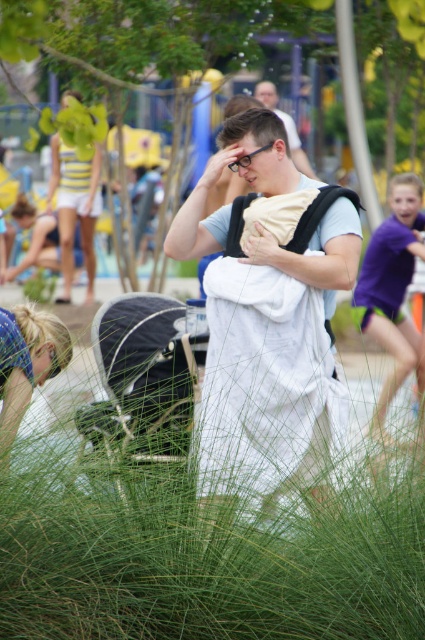
Question: Can you confirm if purple cotton shirt at right is wider than blonde hair at lower left?

Choices:
 (A) no
 (B) yes

Answer: (B)

Question: Which point appears closest to the camera in this image?

Choices:
 (A) (65, 161)
 (B) (374, 426)

Answer: (B)

Question: Does green soft grass at center lie behind blonde hair at lower left?

Choices:
 (A) yes
 (B) no

Answer: (B)

Question: Can you confirm if green soft grass at center is positioned to the left of purple cotton shirt at right?

Choices:
 (A) no
 (B) yes

Answer: (B)

Question: Which point is closer to the camera?

Choices:
 (A) (25, 573)
 (B) (365, 298)
 (C) (30, 360)
 (D) (314, 179)

Answer: (A)

Question: Which of these objects is positioned closest to the white cotton baby carrier at center?

Choices:
 (A) yellow striped tank top at upper left
 (B) matte black baby carrier at center
 (C) purple cotton shirt at right

Answer: (C)